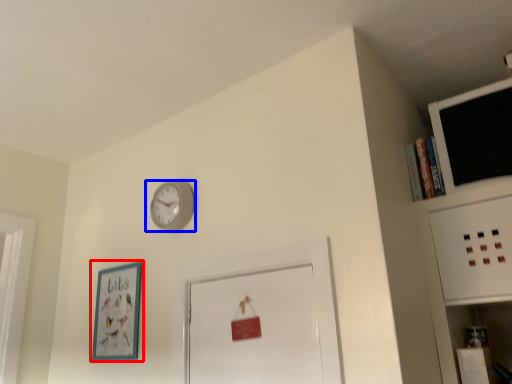
Question: Which point is closer to the camera, picture frame (highlighted by a red box) or wall clock (highlighted by a blue box)?

Choices:
 (A) picture frame
 (B) wall clock

Answer: (B)